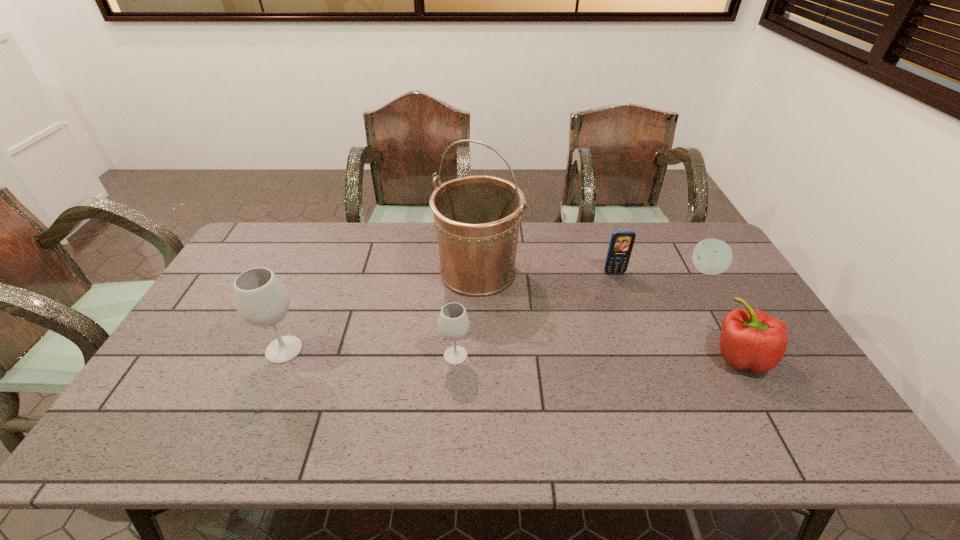
What are the coordinates of `the fifth shortest object` in the screenshot? It's located at (261, 299).

Identify the location of the left wineglass. The image size is (960, 540). (261, 299).

Locate an element on the screen. Image resolution: width=960 pixels, height=540 pixels. the right wineglass is located at coordinates (453, 323).

Locate an element on the screen. This screenshot has height=540, width=960. the third object from right to left is located at coordinates (621, 243).

Identify the location of the shortest object. (711, 256).

Where is `the tallest object`? the tallest object is located at coordinates click(x=477, y=218).

Where is `bell pepper`? The height and width of the screenshot is (540, 960). bell pepper is located at coordinates (754, 340).

I want to click on vacant space located on the right of the left wineglass, so click(x=328, y=349).

At what (x,y) coordinates should I click in order to perform the action: click on free space located on the back of the right wineglass. Please return your answer as a coordinate pair (x, y). The height and width of the screenshot is (540, 960). Looking at the image, I should click on (457, 322).

Where is `vacant space located 0.340m on the screen of the fourth object from left to right`? The width and height of the screenshot is (960, 540). vacant space located 0.340m on the screen of the fourth object from left to right is located at coordinates (x=644, y=359).